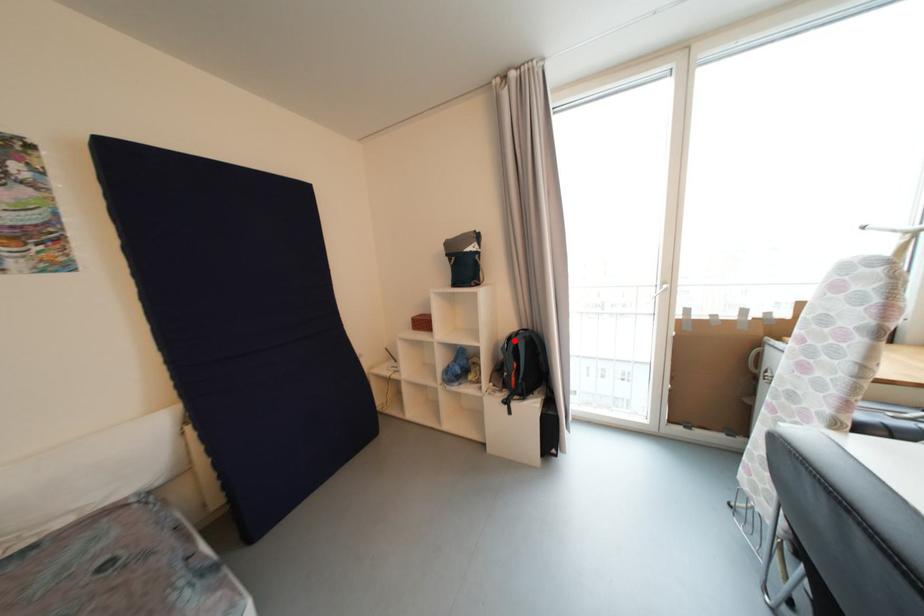
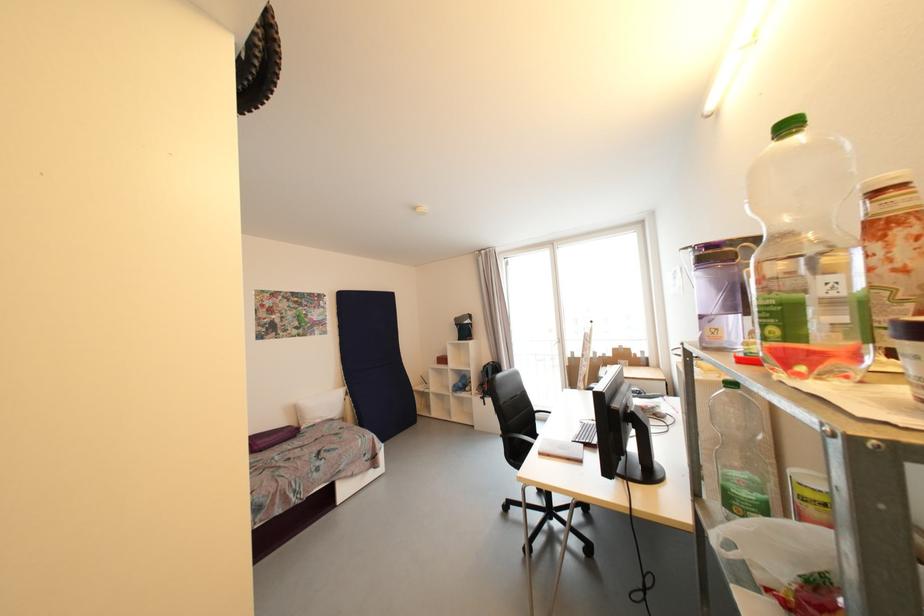
Where in the second image is the point corresponding to the highlighted location from the first image?

(490, 368)